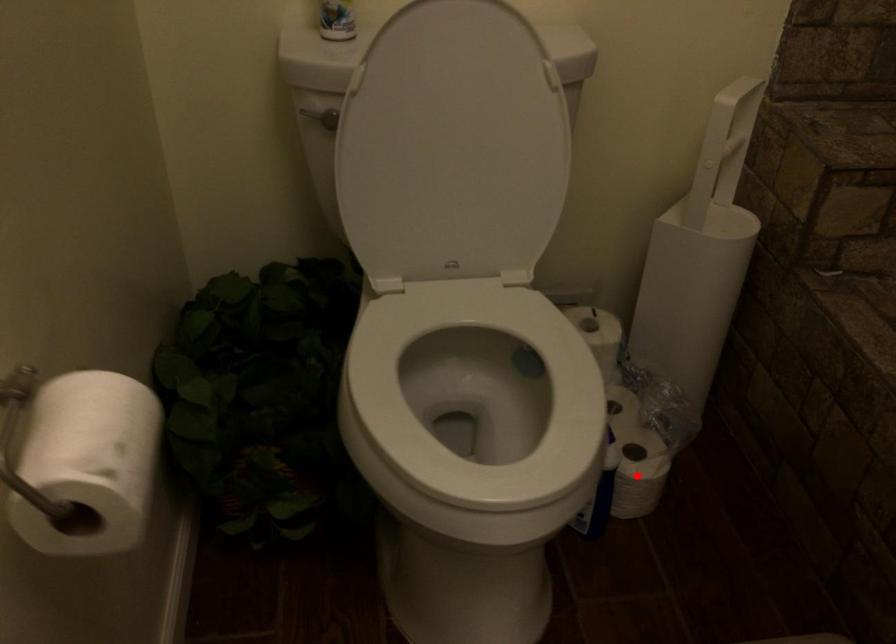
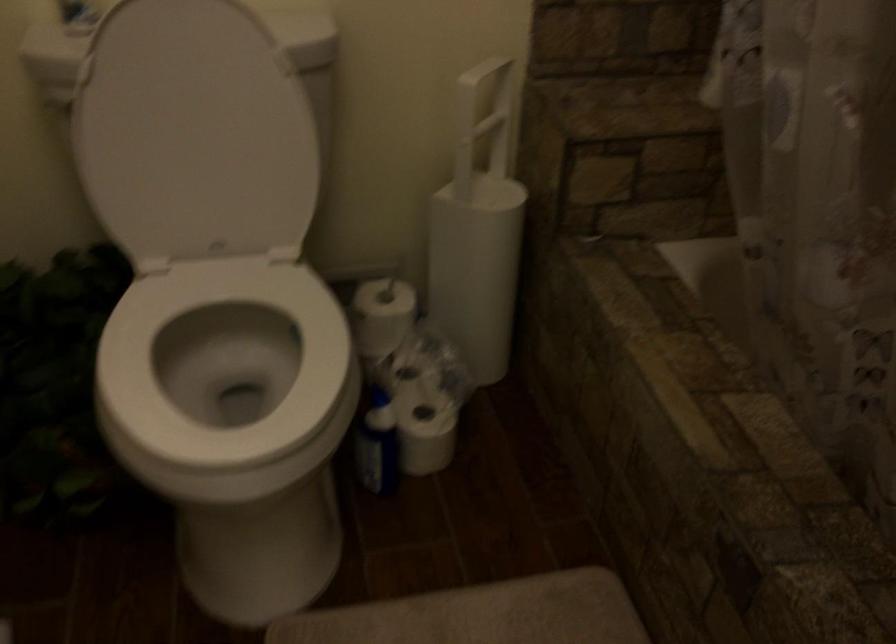
Find the pixel in the second image that matches the highlighted location in the first image.

(426, 436)